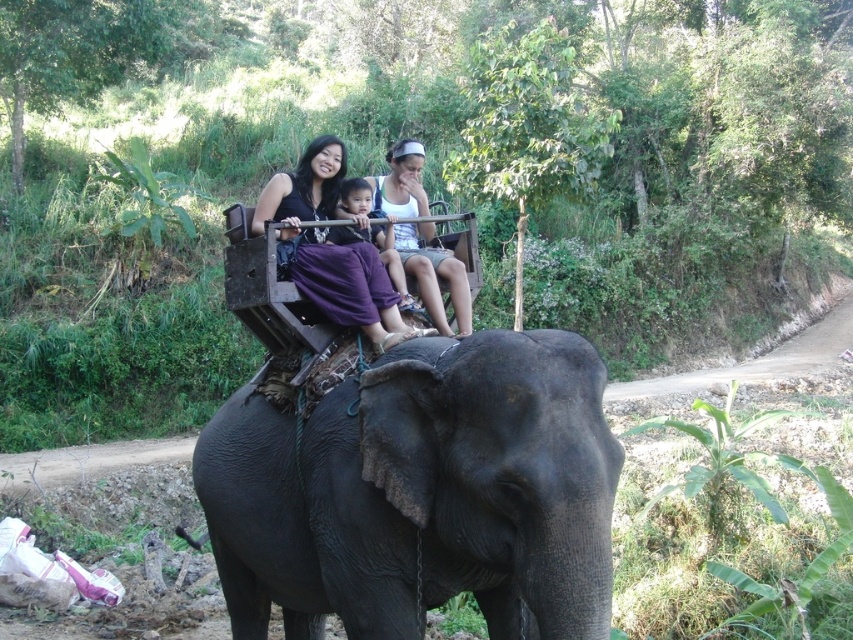
Question: Which point is closer to the camera?

Choices:
 (A) white cotton tank top at center
 (B) dark gray textured elephant at center

Answer: (B)

Question: Does dark gray textured elephant at center have a larger size compared to white cotton tank top at center?

Choices:
 (A) no
 (B) yes

Answer: (B)

Question: Considering the real-world distances, which object is closest to the white cotton tank top at center?

Choices:
 (A) dark gray textured elephant at center
 (B) matte purple skirt at center

Answer: (B)

Question: Among these objects, which one is farthest from the camera?

Choices:
 (A) matte purple skirt at center
 (B) white cotton tank top at center

Answer: (B)

Question: Can you confirm if matte purple skirt at center is positioned above white cotton tank top at center?

Choices:
 (A) yes
 (B) no

Answer: (B)

Question: Does matte purple skirt at center have a greater width compared to white cotton tank top at center?

Choices:
 (A) yes
 (B) no

Answer: (A)